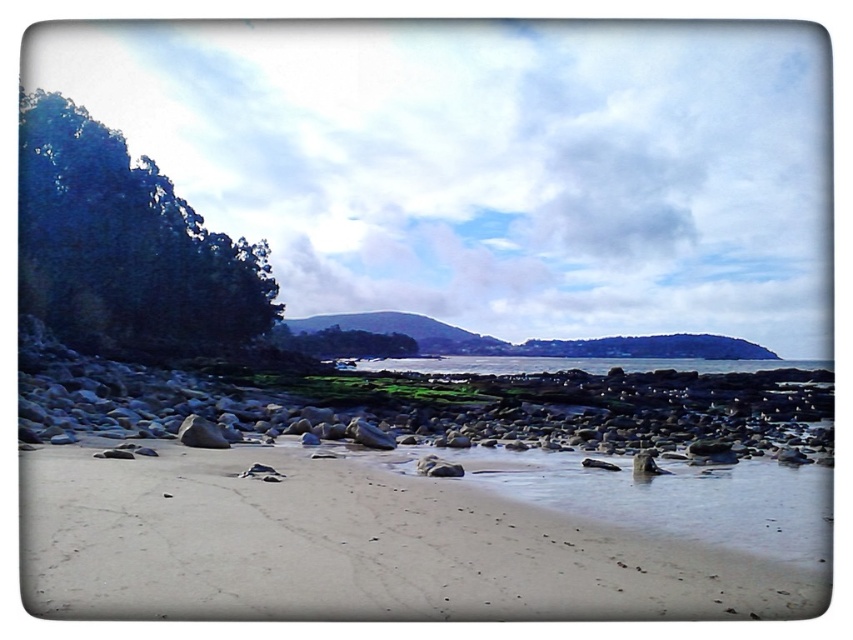
Who is positioned more to the right, sandy beach at lower center or clear blue water at center?

From the viewer's perspective, clear blue water at center appears more on the right side.

Does point (231, 515) come closer to viewer compared to point (363, 362)?

Yes, point (231, 515) is in front of point (363, 362).

Identify the location of sandy beach at lower center. Image resolution: width=853 pixels, height=640 pixels. (352, 545).

Looking at this image, between clear blue water at center and smooth gray rock at lower left, which one appears on the right side from the viewer's perspective?

From the viewer's perspective, clear blue water at center appears more on the right side.

Between clear blue water at center and smooth gray rock at lower left, which one has less height?

smooth gray rock at lower left is shorter.

Identify the location of clear blue water at center. Image resolution: width=853 pixels, height=640 pixels. (575, 364).

Where is `clear blue water at center`? Image resolution: width=853 pixels, height=640 pixels. clear blue water at center is located at coordinates (575, 364).

I want to click on sandy beach at lower center, so click(x=352, y=545).

Who is more distant from viewer, [335,465] or [195,422]?

Point [195,422]

Who is more distant from viewer, (85, 536) or (212, 432)?

The point (212, 432) is more distant.

You are a GUI agent. You are given a task and a screenshot of the screen. Output one action in this format:
    pyautogui.click(x=<x>, y=<y>)
    Task: Click on the sandy beach at lower center
    The width and height of the screenshot is (853, 640).
    Given the screenshot: What is the action you would take?
    pyautogui.click(x=352, y=545)